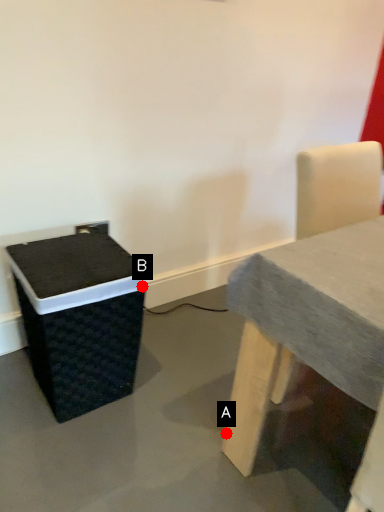
Question: Two points are circled on the image, labeled by A and B beside each circle. Which point is closer to the camera?

Choices:
 (A) A is closer
 (B) B is closer

Answer: (A)